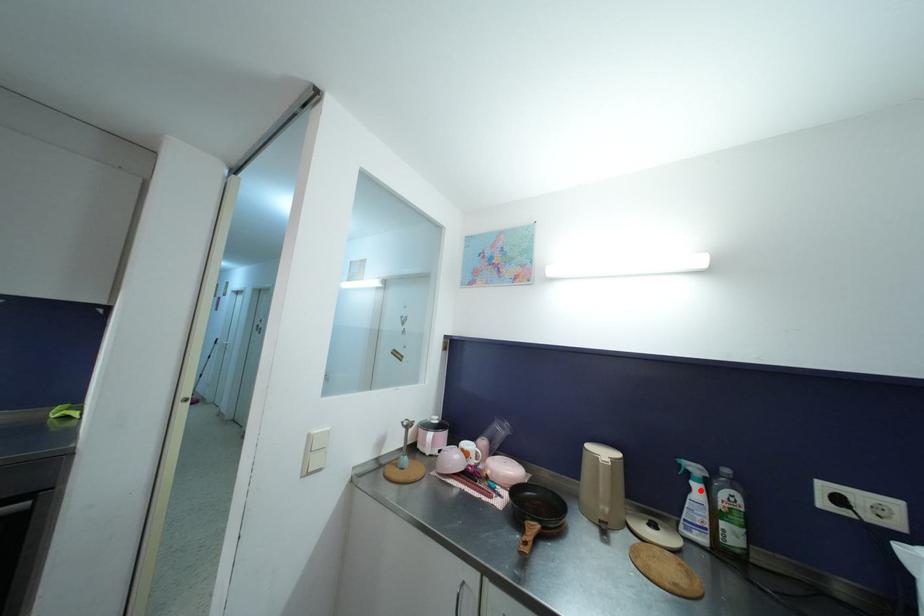
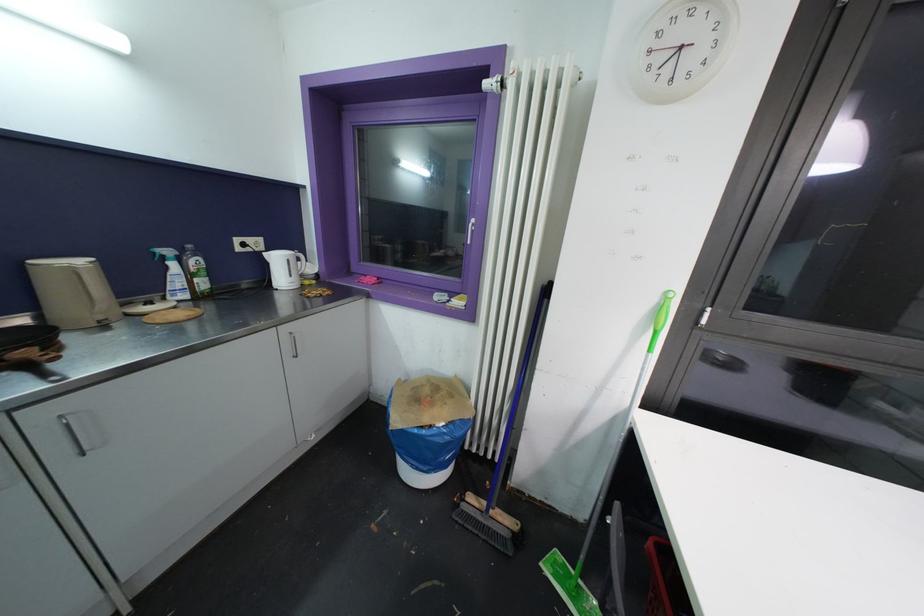
Question: I am providing you with two images of the same scene from different viewpoints. A red point is marked on the first image. Can you still see the location of the red point in image 2?

Choices:
 (A) Yes
 (B) No

Answer: (A)